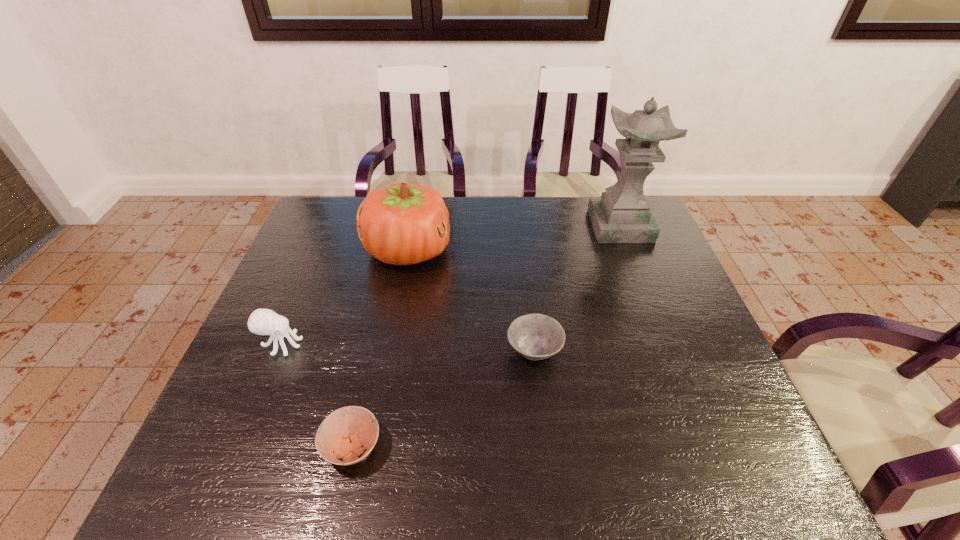
This screenshot has height=540, width=960. Find the location of `unoccupied area between the taller bowl and the third tallest object`. unoccupied area between the taller bowl and the third tallest object is located at coordinates (408, 348).

This screenshot has width=960, height=540. In order to click on vacant region between the sculpture and the pumpkin in this screenshot , I will do 514,238.

I want to click on free space between the taller bowl and the shorter bowl, so click(444, 400).

At what (x,y) coordinates should I click in order to perform the action: click on the second closest object relative to the right bowl. Please return your answer as a coordinate pair (x, y). This screenshot has width=960, height=540. Looking at the image, I should click on point(344,432).

Identify the location of object that is the second closest to the pumpkin. (535, 336).

Locate an element on the screen. free space that satisfies the following two spatial constraints: 1. at the front opening of the tallest object; 2. on the front-facing side of the leftmost object is located at coordinates (666, 344).

The height and width of the screenshot is (540, 960). I want to click on vacant space that satisfies the following two spatial constraints: 1. at the front opening of the tallest object; 2. on the front-facing side of the leftmost object, so click(x=666, y=344).

I want to click on vacant region that satisfies the following two spatial constraints: 1. on the front-facing side of the octopus; 2. on the left side of the taller bowl, so click(x=278, y=352).

Identify the location of vacant region that satisfies the following two spatial constraints: 1. on the front-facing side of the left bowl; 2. on the right side of the leftmost object. (239, 447).

Where is `blank space that satisfies the following two spatial constraints: 1. on the side of the farther bowl with the cute face; 2. on the left side of the pumpkin`? blank space that satisfies the following two spatial constraints: 1. on the side of the farther bowl with the cute face; 2. on the left side of the pumpkin is located at coordinates (389, 352).